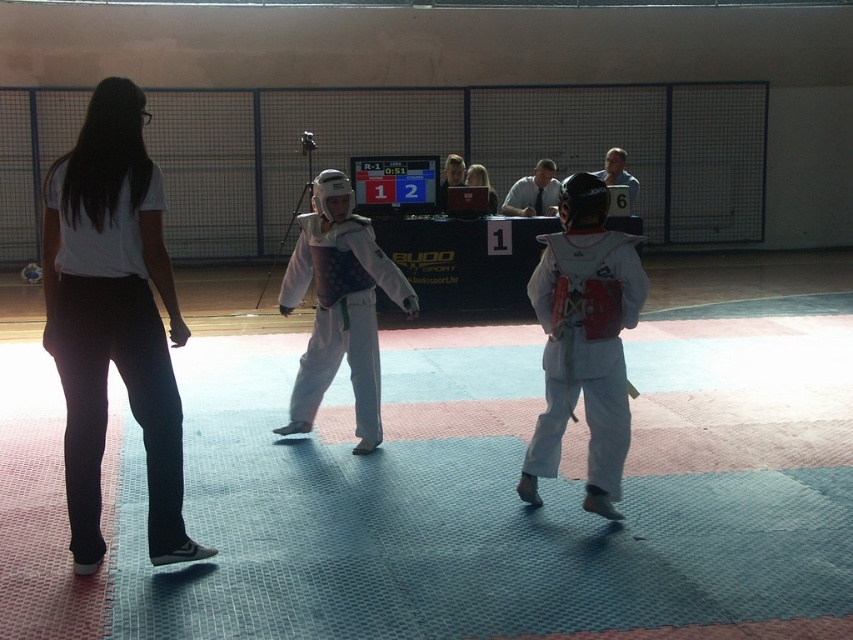
Question: Among these objects, which one is farthest from the camera?

Choices:
 (A) white matte karate uniform at center
 (B) white matte pants at left

Answer: (A)

Question: Is white matte pants at left further to camera compared to white matte karate uniform at center?

Choices:
 (A) yes
 (B) no

Answer: (B)

Question: Is the position of white matte pants at left more distant than that of white matte karate uniform at center?

Choices:
 (A) no
 (B) yes

Answer: (A)

Question: Which object appears closest to the camera in this image?

Choices:
 (A) white matte uniform at center
 (B) white matte pants at left

Answer: (B)

Question: Does white matte karate uniform at center come in front of white matte uniform at center?

Choices:
 (A) yes
 (B) no

Answer: (A)

Question: Which object appears closest to the camera in this image?

Choices:
 (A) white matte pants at left
 (B) white matte uniform at center

Answer: (A)